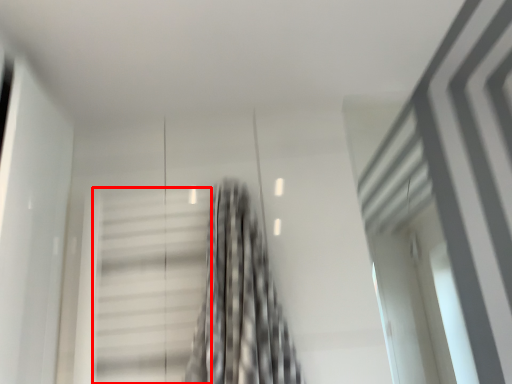
Question: From the image's perspective, what is the correct spatial relationship of stairs (annotated by the red box) in relation to curtain?

Choices:
 (A) below
 (B) above

Answer: (A)